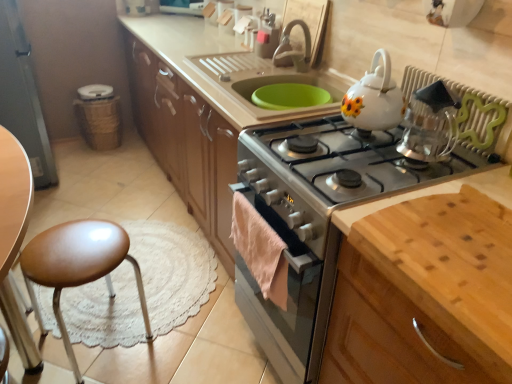
Find the location of `free spot to the left of clear glass kettle at upper right`. free spot to the left of clear glass kettle at upper right is located at coordinates (371, 148).